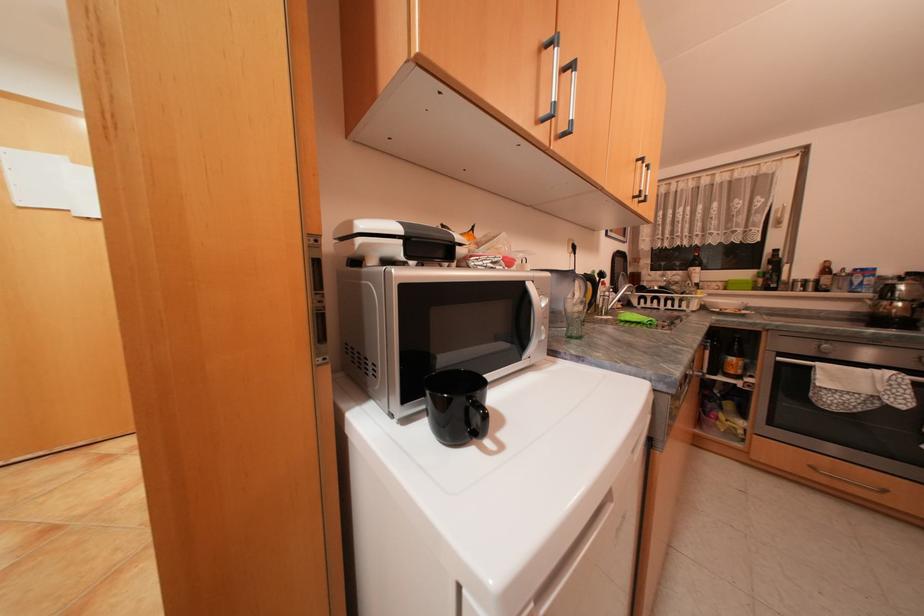
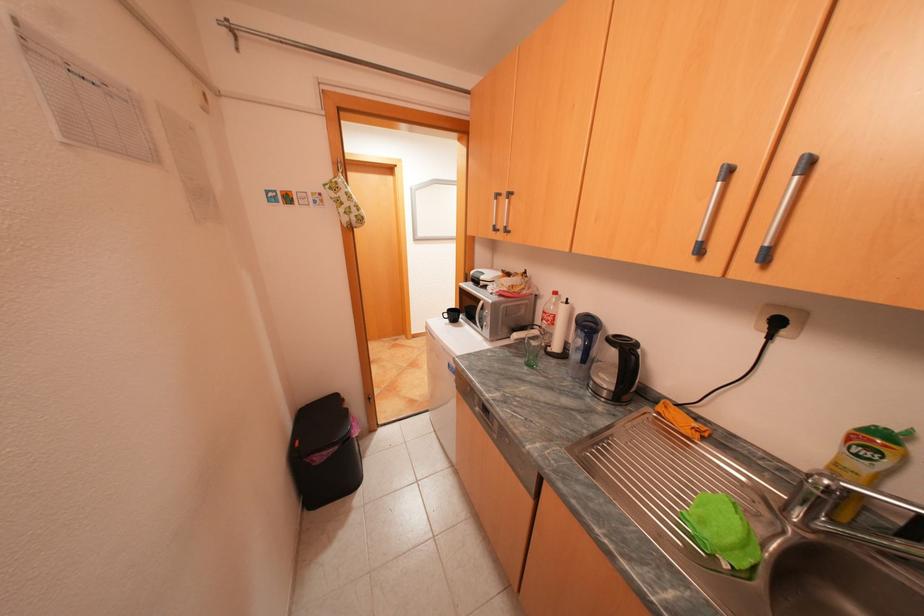
Question: I am providing you with two images of the same scene from different viewpoints. Please identify which objects are invisible in image2.

Choices:
 (A) red plastic bottle
 (B) paper towel roll
 (C) patterned oven mitt
 (D) none of these

Answer: (D)